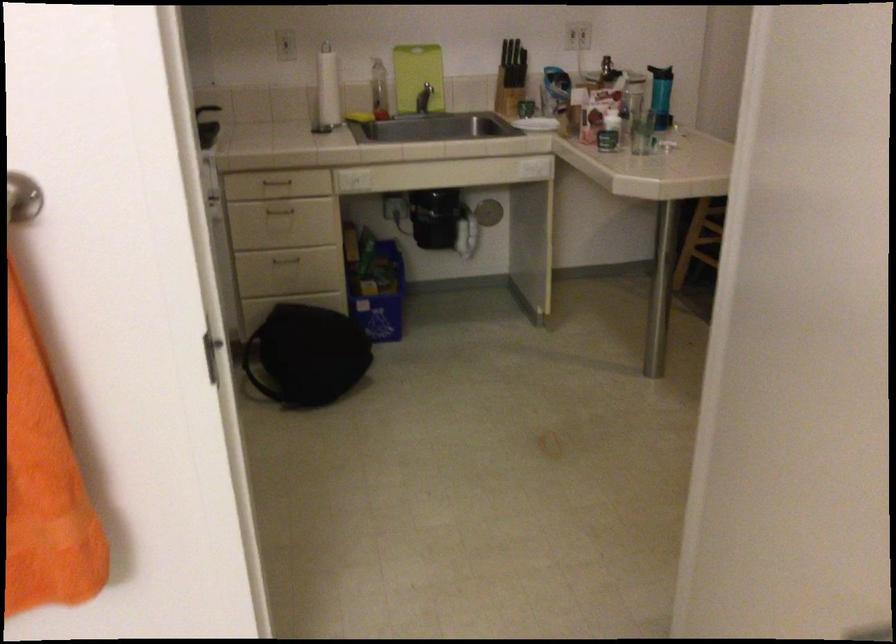
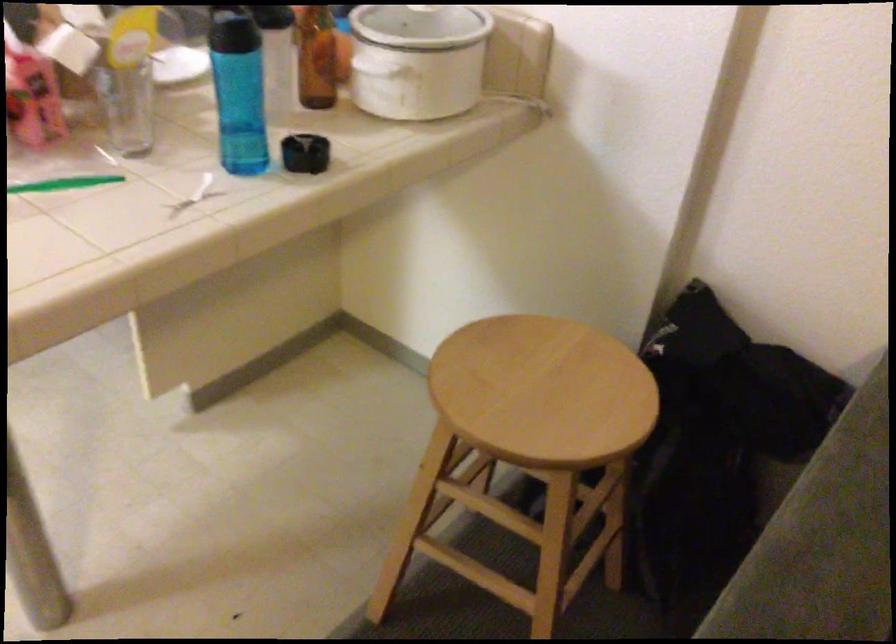
Where in the second image is the point corresponding to (631,80) from the first image?

(418, 60)